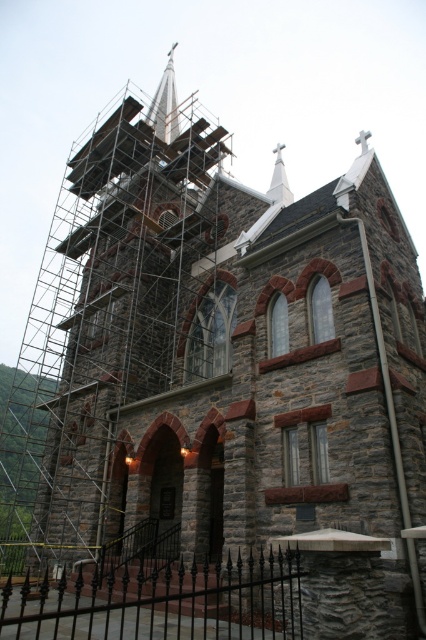
You are a photographer standing in front of the historic stone church. You notice two points marked on the scaffolding around the steeple. The first point is at coordinates point (172, 67) and the second is at point (285, 177). Which point is closer to your camera?

Point (172, 67) is further to the camera than point (285, 177), so the second point is closer to the camera.